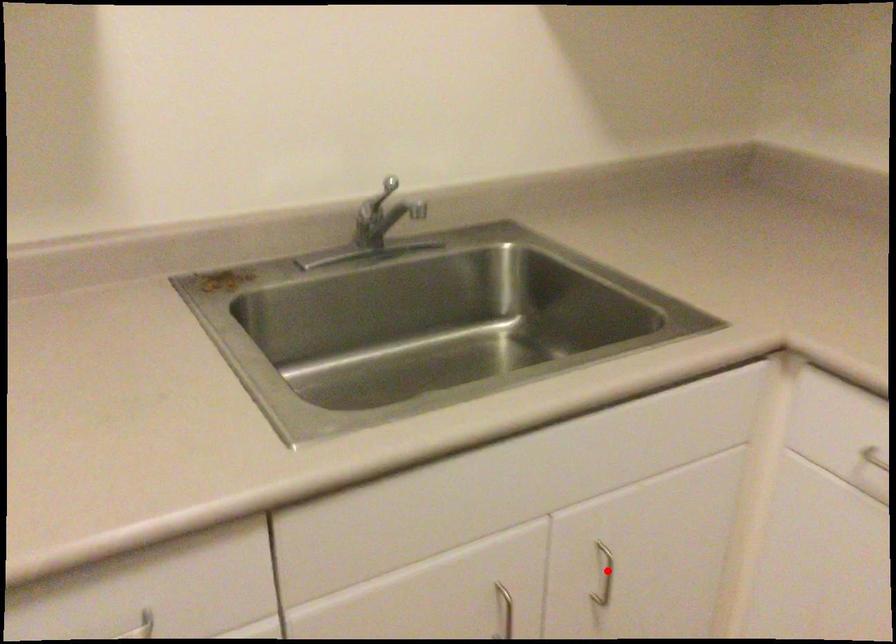
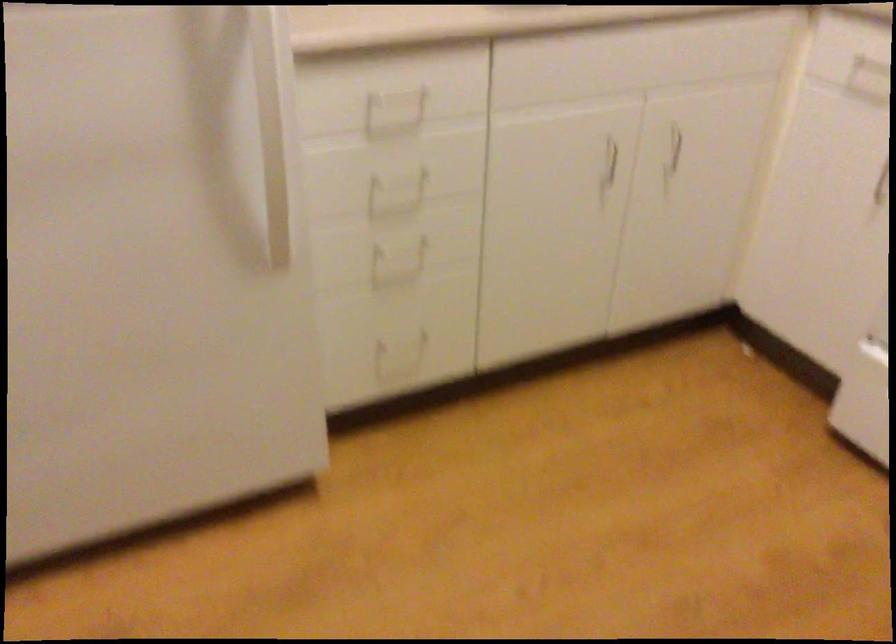
Question: I am providing you with two images of the same scene from different viewpoints. Image1 has a red point marked. In image2, the corresponding 3D location appears at what relative position? Reply with the corresponding letter.

Choices:
 (A) Closer
 (B) Farther

Answer: (B)